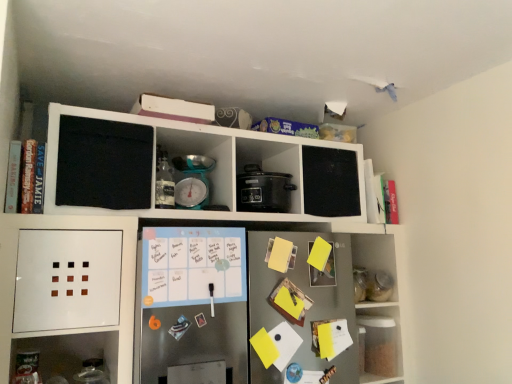
Locate an element on the screen. vacant space situated above teal plastic scale at center, the 2th appliance when ordered from right to left (from a real-world perspective) is located at coordinates (197, 150).